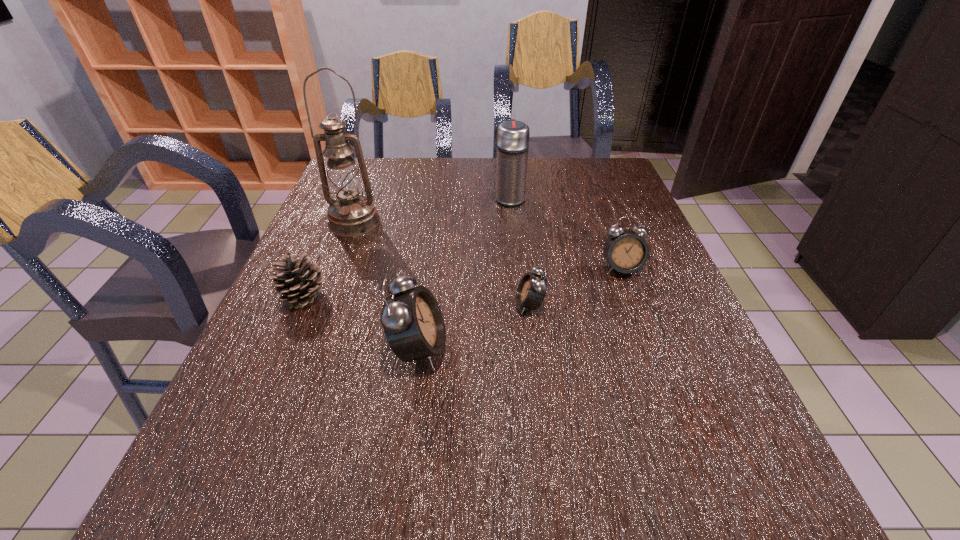
The image size is (960, 540). I want to click on pinecone, so click(299, 280).

Find the location of a particular element. The image size is (960, 540). vacant region located on the face of the fourth object from right to left is located at coordinates (x=472, y=349).

Find the location of a particular element. vacant region located 0.070m on the face of the second alarm clock from left to right is located at coordinates click(483, 305).

Image resolution: width=960 pixels, height=540 pixels. In order to click on free space located on the face of the second alarm clock from left to right in this screenshot , I will do `click(437, 305)`.

Locate an element on the screen. The width and height of the screenshot is (960, 540). vacant space located 0.270m on the face of the second alarm clock from left to right is located at coordinates (390, 305).

The width and height of the screenshot is (960, 540). I want to click on vacant space located on the face of the fourth nearest object, so click(x=670, y=400).

The width and height of the screenshot is (960, 540). What are the coordinates of `vacant region located 0.150m on the back of the second farthest object` in the screenshot? It's located at tap(370, 182).

The width and height of the screenshot is (960, 540). I want to click on vacant space located 0.140m with a handle on the side of the thermos bottle, so click(507, 166).

Image resolution: width=960 pixels, height=540 pixels. I want to click on blank area located 0.060m with a handle on the side of the thermos bottle, so click(508, 179).

Image resolution: width=960 pixels, height=540 pixels. I want to click on vacant space located with a handle on the side of the thermos bottle, so click(507, 166).